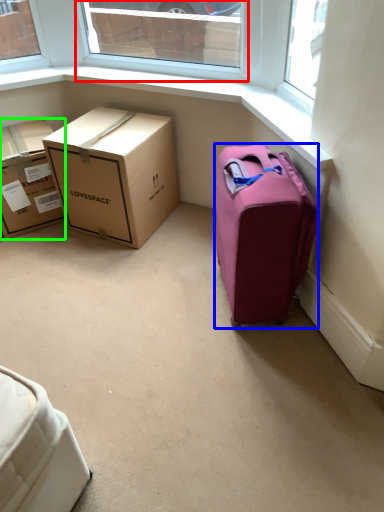
Question: Estimate the real-world distances between objects in this image. Which object is farther from window (highlighted by a red box), suitcase (highlighted by a blue box) or box (highlighted by a green box)?

Choices:
 (A) suitcase
 (B) box

Answer: (A)